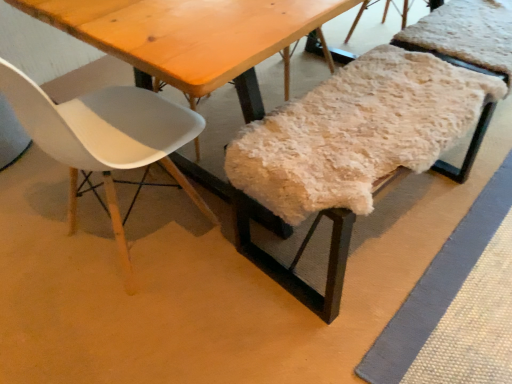
Question: Do you think fuzzy woolen bench at center, marked as the 2th chair in a left-to-right arrangement, is within white matte plastic chair at left, which ranks as the first chair in left-to-right order, or outside of it?

Choices:
 (A) inside
 (B) outside

Answer: (B)

Question: Is point (331, 304) positioned closer to the camera than point (80, 122)?

Choices:
 (A) farther
 (B) closer

Answer: (A)

Question: From their relative heights in the image, would you say fuzzy woolen bench at center, marked as the 2th chair in a left-to-right arrangement, is taller or shorter than white matte plastic chair at left, which ranks as the first chair in left-to-right order?

Choices:
 (A) tall
 (B) short

Answer: (B)

Question: Looking at their shapes, would you say white matte plastic chair at left, positioned as the second chair in right-to-left order, is wider or thinner than fuzzy woolen bench at center, marked as the 2th chair in a left-to-right arrangement?

Choices:
 (A) wide
 (B) thin

Answer: (A)

Question: Considering the relative positions of white matte plastic chair at left, which ranks as the first chair in left-to-right order, and fuzzy woolen bench at center, marked as the 2th chair in a left-to-right arrangement, in the image provided, is white matte plastic chair at left, which ranks as the first chair in left-to-right order, to the left or to the right of fuzzy woolen bench at center, marked as the 2th chair in a left-to-right arrangement,?

Choices:
 (A) right
 (B) left

Answer: (B)

Question: Is point (112, 110) closer or farther from the camera than point (229, 190)?

Choices:
 (A) farther
 (B) closer

Answer: (B)

Question: From a real-world perspective, is white matte plastic chair at left, positioned as the second chair in right-to-left order, above or below fuzzy woolen bench at center, marked as the 2th chair in a left-to-right arrangement?

Choices:
 (A) below
 (B) above

Answer: (B)